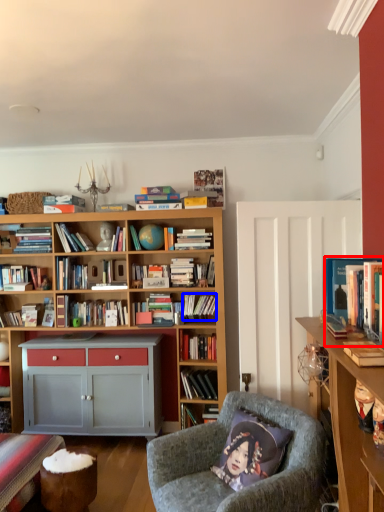
Question: Which object is closer to the camera taking this photo, book (highlighted by a red box) or book (highlighted by a blue box)?

Choices:
 (A) book
 (B) book

Answer: (A)